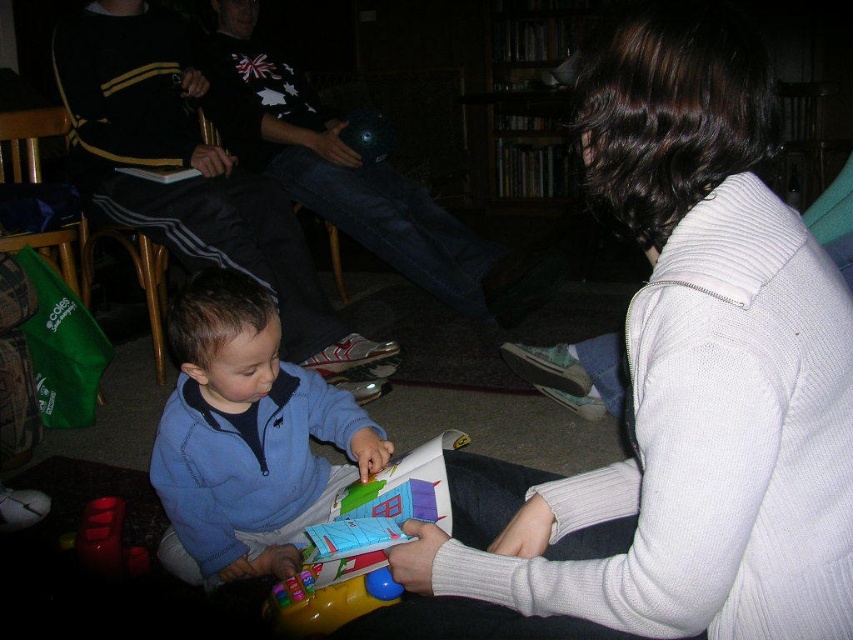
You are a photographer setting up a shoot in this scene. You need to position a light source to the left of the rubberized red toy at lower left. Will the blue fleece jacket at center block the light from reaching the toy?

The blue fleece jacket at center is to the right of the rubberized red toy at lower left, so placing the light source to the left of the toy would not be blocked by the jacket. The light should reach the toy without obstruction.

In the scene shown: You are standing in the room and want to determine which of the two points, point (172, 545) or point (141, 557), is closer to you. Based on the scene description, which point is nearer?

Point (172, 545) is further to the viewer than point (141, 557), so the closer point to you is point (141, 557).

You are a parent trying to place a small toy on the floor between the plastic colorful toy at center and the rubberized red toy at lower left. The toy you have is 12 inches long. Can you fit it between them without moving either existing toys?

The plastic colorful toy at center and the rubberized red toy at lower left are 18.88 inches apart. Since the toy you have is 12 inches long, it can fit between them as the distance between the two toys is greater than the length of your toy.